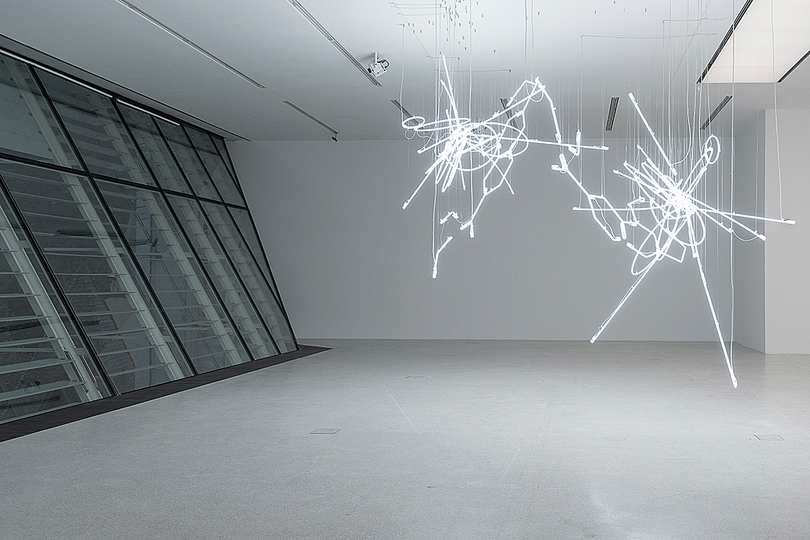
Identify the location of black window frame. (87, 173).